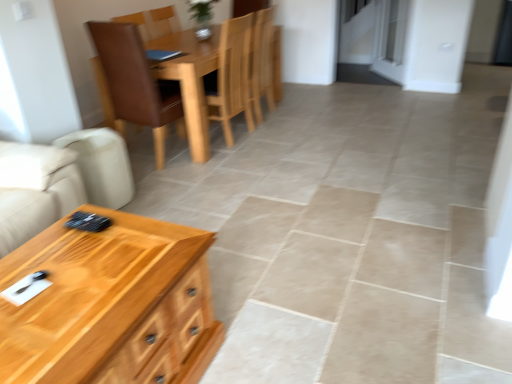
Question: Is wooden chair at center, positioned as the first chair in right-to-left order, wider or thinner than wooden coffee table at lower left?

Choices:
 (A) thin
 (B) wide

Answer: (A)

Question: Does point (249, 28) appear closer or farther from the camera than point (5, 274)?

Choices:
 (A) closer
 (B) farther

Answer: (B)

Question: Considering the real-world distances, which object is closest to the wooden coffee table at lower left?

Choices:
 (A) wooden chair at center, the second chair in the left-to-right sequence
 (B) brown leather chair at upper center, marked as the first chair in a left-to-right arrangement

Answer: (B)

Question: Considering the real-world distances, which object is closest to the wooden chair at center, the second chair in the left-to-right sequence?

Choices:
 (A) wooden coffee table at lower left
 (B) brown leather chair at upper center, which is counted as the 2th chair, starting from the right

Answer: (B)